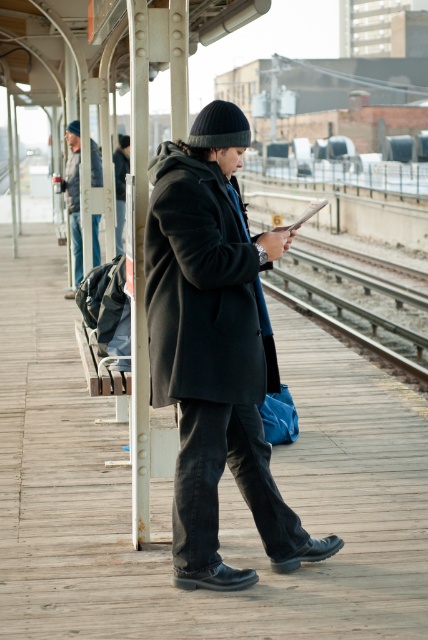
You are a photographer trying to capture a photo of the matte black coat at center and the metal train track at center. Based on their heights, which one should you focus on first if you want to ensure both are in frame without adjusting your camera angle?

The matte black coat at center is taller than the metal train track at center, so you should focus on the matte black coat at center first to ensure both are in frame without adjusting your camera angle.

Consider the image. You are a photographer trying to capture a photo of the matte black coat at center and the metal train track at center. Based on their sizes in the image, which object would you need to move closer to in order to make it appear bigger in the photo?

The matte black coat at center has a larger size compared to the metal train track at center. Therefore, to make the metal train track at center appear bigger in the photo, you would need to move closer to it since it is smaller in the image.

You are a photographer trying to capture the black wool coat at center. The camera you are using has a field of view that can only cover a 0.5x0.5 area. Given that the entire scene is represented in a coordinate system from 0 to 1 in both x and y axes, will the black wool coat at center fit entirely within your camera frame if you position the center of your frame at point (201,289)?

The point (201,289) marks the black wool coat at center. Since the camera frame is 0.5x0.5 and centered at the coat, the coat will fit within the frame as it is centered and the frame size is sufficient to encompass it.